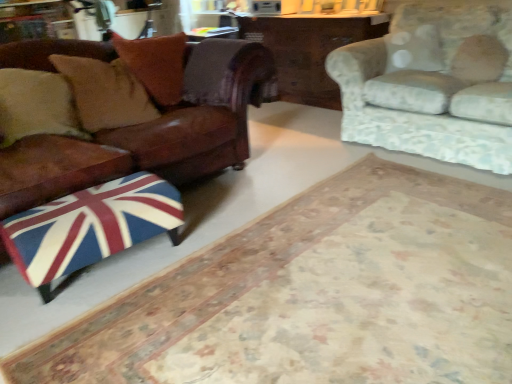
Question: Does union jack fabric ottoman at lower left have a smaller size compared to floral fabric couch at upper right, which is counted as the 2th studio couch, starting from the left?

Choices:
 (A) no
 (B) yes

Answer: (B)

Question: Is union jack fabric ottoman at lower left shorter than floral fabric couch at upper right, which is counted as the 2th studio couch, starting from the left?

Choices:
 (A) no
 (B) yes

Answer: (B)

Question: From a real-world perspective, is union jack fabric ottoman at lower left below floral fabric couch at upper right, the first studio couch when ordered from right to left?

Choices:
 (A) no
 (B) yes

Answer: (B)

Question: Does union jack fabric ottoman at lower left have a greater width compared to floral fabric couch at upper right, which is counted as the 2th studio couch, starting from the left?

Choices:
 (A) no
 (B) yes

Answer: (A)

Question: Does union jack fabric ottoman at lower left have a lesser width compared to floral fabric couch at upper right, which is counted as the 2th studio couch, starting from the left?

Choices:
 (A) yes
 (B) no

Answer: (A)

Question: Does union jack fabric ottoman at lower left have a greater height compared to floral fabric couch at upper right, which is counted as the 2th studio couch, starting from the left?

Choices:
 (A) no
 (B) yes

Answer: (A)

Question: Is union jack fabric ottoman at lower left not close to wooden table at center?

Choices:
 (A) no
 (B) yes

Answer: (B)

Question: Considering the relative sizes of union jack fabric ottoman at lower left and wooden table at center in the image provided, is union jack fabric ottoman at lower left taller than wooden table at center?

Choices:
 (A) yes
 (B) no

Answer: (B)

Question: Is union jack fabric ottoman at lower left wider than wooden table at center?

Choices:
 (A) yes
 (B) no

Answer: (B)

Question: Could you tell me if union jack fabric ottoman at lower left is turned towards wooden table at center?

Choices:
 (A) yes
 (B) no

Answer: (B)

Question: Does union jack fabric ottoman at lower left have a smaller size compared to wooden table at center?

Choices:
 (A) no
 (B) yes

Answer: (B)

Question: Is union jack fabric ottoman at lower left outside wooden table at center?

Choices:
 (A) yes
 (B) no

Answer: (A)

Question: Considering the relative sizes of leather couch at left, the second studio couch positioned from the right, and floral fabric couch at upper right, which is counted as the 2th studio couch, starting from the left, in the image provided, is leather couch at left, the second studio couch positioned from the right, shorter than floral fabric couch at upper right, which is counted as the 2th studio couch, starting from the left,?

Choices:
 (A) yes
 (B) no

Answer: (B)